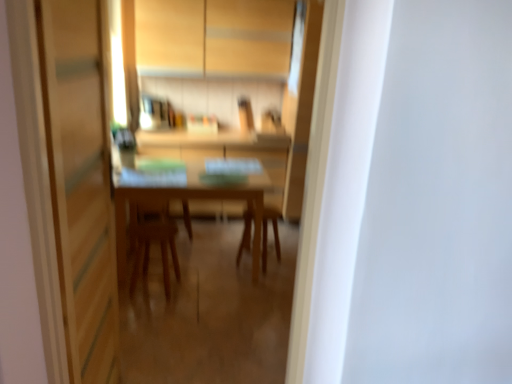
Question: Does point (159, 39) appear closer or farther from the camera than point (272, 228)?

Choices:
 (A) closer
 (B) farther

Answer: (A)

Question: From the image's perspective, is matte wood cabinetry at upper center positioned above or below wooden chair at center?

Choices:
 (A) above
 (B) below

Answer: (A)

Question: Considering the real-world distances, which object is closest to the wooden table at center?

Choices:
 (A) transparent glass screen door at left
 (B) wooden chair at center
 (C) matte wood cabinetry at upper center
 (D) wooden chair at center

Answer: (B)

Question: Which object is the closest to the wooden chair at center?

Choices:
 (A) transparent glass screen door at left
 (B) wooden table at center
 (C) wooden chair at center
 (D) matte wood cabinetry at upper center

Answer: (B)